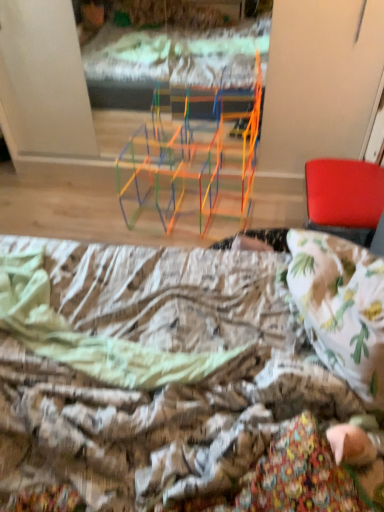
You are a GUI agent. You are given a task and a screenshot of the screen. Output one action in this format:
    pyautogui.click(x=<x>, y=<y>)
    Task: Click on the blank space situated above red leather chair at right (from a real-world perspective)
    The image size is (384, 512).
    Given the screenshot: What is the action you would take?
    pyautogui.click(x=338, y=180)